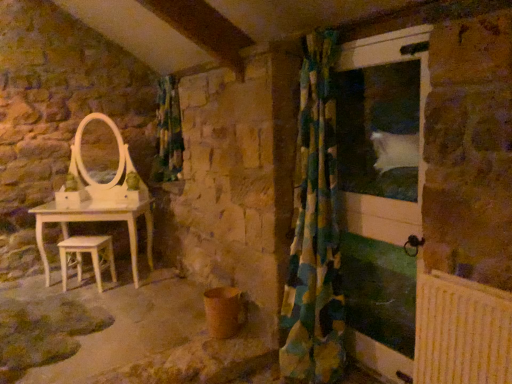
Question: Is green and blue checkered fabric at center to the right of light wood stool at lower left from the viewer's perspective?

Choices:
 (A) yes
 (B) no

Answer: (A)

Question: Considering the relative sizes of green and blue checkered fabric at center and light wood stool at lower left in the image provided, is green and blue checkered fabric at center smaller than light wood stool at lower left?

Choices:
 (A) yes
 (B) no

Answer: (B)

Question: Does green and blue checkered fabric at center appear on the left side of light wood stool at lower left?

Choices:
 (A) yes
 (B) no

Answer: (B)

Question: Can you confirm if green and blue checkered fabric at center is shorter than light wood stool at lower left?

Choices:
 (A) no
 (B) yes

Answer: (A)

Question: Can you see green and blue checkered fabric at center touching light wood stool at lower left?

Choices:
 (A) no
 (B) yes

Answer: (A)

Question: From a real-world perspective, is green and blue checkered fabric at center on top of light wood stool at lower left?

Choices:
 (A) no
 (B) yes

Answer: (B)

Question: Would you say green-yellow checkered curtain at right is a long distance from light wood stool at lower left?

Choices:
 (A) yes
 (B) no

Answer: (A)

Question: Is green-yellow checkered curtain at right in contact with light wood stool at lower left?

Choices:
 (A) no
 (B) yes

Answer: (A)

Question: Does green-yellow checkered curtain at right have a lesser width compared to light wood stool at lower left?

Choices:
 (A) yes
 (B) no

Answer: (B)

Question: From a real-world perspective, is green-yellow checkered curtain at right under light wood stool at lower left?

Choices:
 (A) yes
 (B) no

Answer: (B)

Question: Does green-yellow checkered curtain at right appear on the right side of light wood stool at lower left?

Choices:
 (A) yes
 (B) no

Answer: (A)

Question: Can we say green-yellow checkered curtain at right lies outside light wood stool at lower left?

Choices:
 (A) yes
 (B) no

Answer: (A)

Question: From a real-world perspective, is white glossy screen door at right over green and blue checkered fabric at center?

Choices:
 (A) no
 (B) yes

Answer: (A)